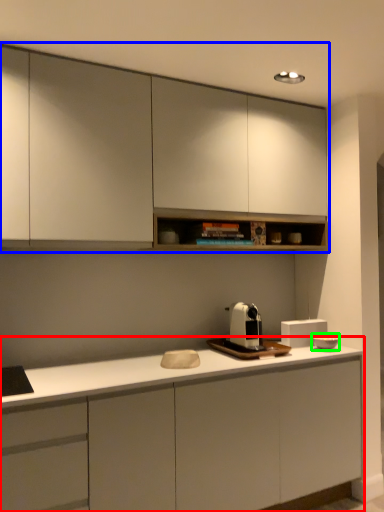
Question: Estimate the real-world distances between objects in this image. Which object is farther from cabinetry (highlighted by a red box), cabinetry (highlighted by a blue box) or appliance (highlighted by a green box)?

Choices:
 (A) cabinetry
 (B) appliance

Answer: (A)